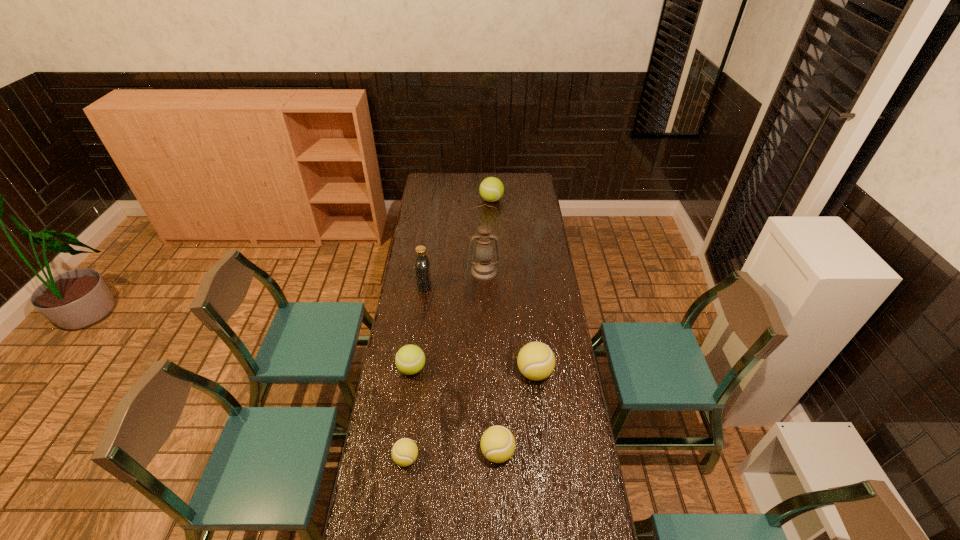
Identify the location of object located in the right edge section of the desktop. Image resolution: width=960 pixels, height=540 pixels. (536, 361).

I want to click on free space at the left edge of the desktop, so click(x=419, y=206).

Image resolution: width=960 pixels, height=540 pixels. In order to click on free space at the right edge of the desktop in this screenshot , I will do `click(536, 264)`.

Locate an element on the screen. Image resolution: width=960 pixels, height=540 pixels. vacant area at the far left corner is located at coordinates click(442, 187).

In the image, there is a desktop. What are the coordinates of `free space at the far right corner` in the screenshot? It's located at (528, 186).

Locate an element on the screen. empty location between the rightmost yellow tennis ball and the second yellow tennis ball from right to left is located at coordinates (516, 412).

The height and width of the screenshot is (540, 960). I want to click on free area in between the second biggest yellow tennis ball and the shortest object, so click(452, 455).

Identify the location of free space that is in between the shortest tennis ball and the tallest object. The width and height of the screenshot is (960, 540). (445, 364).

Locate an element on the screen. The width and height of the screenshot is (960, 540). free space between the vodka and the tallest object is located at coordinates (454, 278).

Where is `vacant point located between the second tallest object and the second biggest yellow tennis ball`? vacant point located between the second tallest object and the second biggest yellow tennis ball is located at coordinates (461, 369).